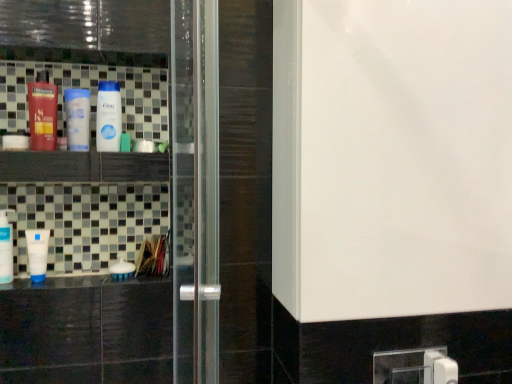
Question: Is matte black bottle at left, positioned as the third bottle in left-to-right order, taller or shorter than white matte tube at lower left, which ranks as the fifth bottle in right-to-left order?

Choices:
 (A) short
 (B) tall

Answer: (B)

Question: Is matte black bottle at left, which is the fourth bottle from right to left, inside or outside of white matte tube at lower left, placed as the second bottle when sorted from left to right?

Choices:
 (A) inside
 (B) outside

Answer: (B)

Question: Considering the real-world distances, which object is farthest from the white glossy tube at left, which is the first bottle in left-to-right order?

Choices:
 (A) white glossy counter top at lower left
 (B) matte black bottle at left, positioned as the third bottle in left-to-right order
 (C) white glossy bottle at center, which is counted as the 5th bottle, starting from the left
 (D) white matte bottle at center, positioned as the 6th bottle in left-to-right order
 (E) white matte tube at lower left, placed as the second bottle when sorted from left to right

Answer: (C)

Question: Estimate the real-world distances between objects in this image. Which object is closer to the white glossy bottle at center, which is the 2th bottle from right to left?

Choices:
 (A) white glossy tube at left, which is the first bottle in left-to-right order
 (B) white glossy counter top at lower left
 (C) transparent glass screen door at center
 (D) white matte bottle at left, which appears as the 4th bottle when viewed from the left
 (E) white matte tube at lower left, which ranks as the fifth bottle in right-to-left order

Answer: (D)